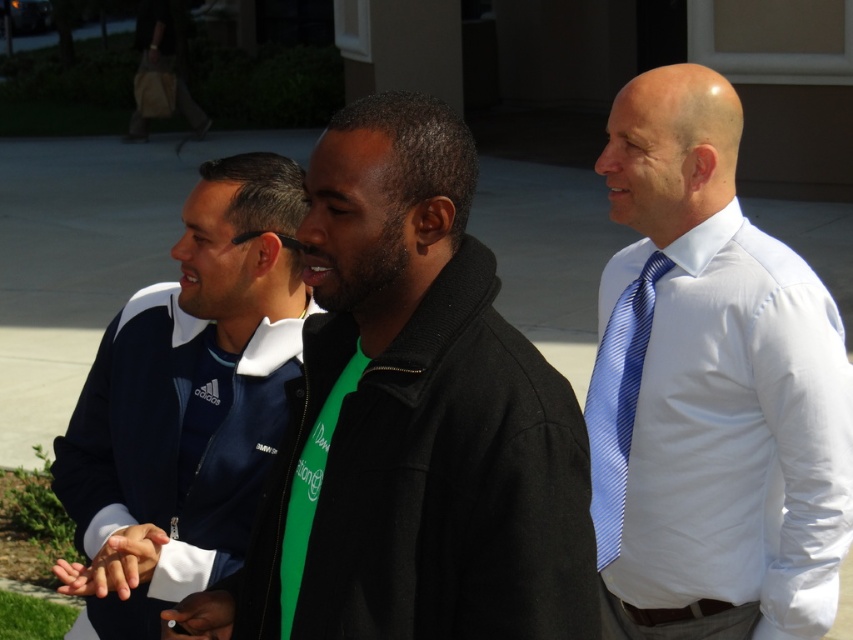
Question: Does black matte jacket at center appear on the right side of blue striped tie at right?

Choices:
 (A) no
 (B) yes

Answer: (A)

Question: In this image, where is dark blue adidas jacket at center located relative to blue striped tie at center?

Choices:
 (A) left
 (B) right

Answer: (A)

Question: Does blue striped tie at right have a larger size compared to blue striped tie at center?

Choices:
 (A) yes
 (B) no

Answer: (A)

Question: Which object is closer to the camera taking this photo?

Choices:
 (A) white smooth dress shirt at right
 (B) black matte jacket at center
 (C) blue striped tie at center
 (D) blue striped tie at right

Answer: (B)

Question: Based on their relative distances, which object is farther from the black matte jacket at center?

Choices:
 (A) blue striped tie at center
 (B) blue striped tie at right
 (C) dark blue adidas jacket at center
 (D) white smooth dress shirt at right

Answer: (D)

Question: Which object is farther from the camera taking this photo?

Choices:
 (A) dark blue adidas jacket at center
 (B) blue striped tie at center

Answer: (A)